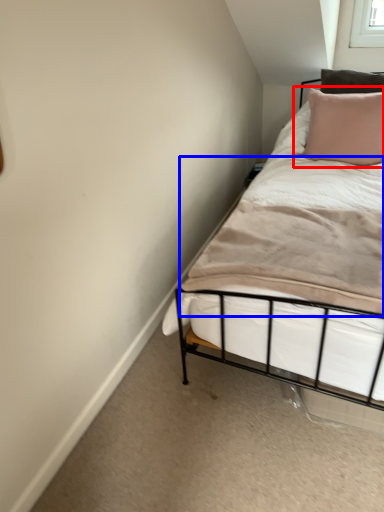
Question: Which object appears farthest to the camera in this image, pillow (highlighted by a red box) or mattress (highlighted by a blue box)?

Choices:
 (A) pillow
 (B) mattress

Answer: (A)